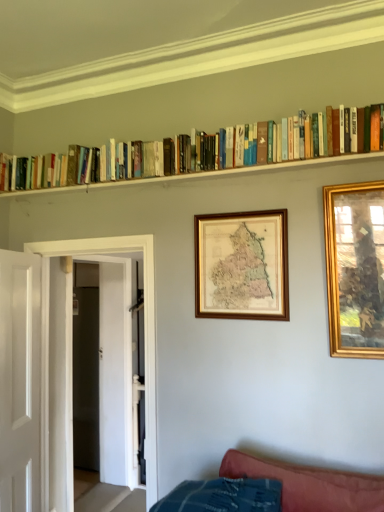
Question: Is gold-framed picture at right, arranged as the first picture frame when viewed from the front, oriented away from hardcover books at upper center?

Choices:
 (A) yes
 (B) no

Answer: (B)

Question: Is gold-framed picture at right, arranged as the 2th picture frame when viewed from the left, oriented towards hardcover books at upper center?

Choices:
 (A) yes
 (B) no

Answer: (B)

Question: Is there a large distance between gold-framed picture at right, arranged as the 2th picture frame when viewed from the left, and hardcover books at upper center?

Choices:
 (A) yes
 (B) no

Answer: (B)

Question: Is gold-framed picture at right, positioned as the second picture frame in back-to-front order, taller than hardcover books at upper center?

Choices:
 (A) no
 (B) yes

Answer: (B)

Question: Is gold-framed picture at right, positioned as the second picture frame in back-to-front order, closer to camera compared to hardcover books at upper center?

Choices:
 (A) no
 (B) yes

Answer: (A)

Question: Considering the relative sizes of gold-framed picture at right, arranged as the 2th picture frame when viewed from the left, and hardcover books at upper center in the image provided, is gold-framed picture at right, arranged as the 2th picture frame when viewed from the left, shorter than hardcover books at upper center?

Choices:
 (A) yes
 (B) no

Answer: (B)

Question: Does white smooth door at left, the 1th door positioned from the front, turn towards hardcover books at upper center?

Choices:
 (A) yes
 (B) no

Answer: (B)

Question: Are white smooth door at left, acting as the 2th door starting from the back, and hardcover books at upper center beside each other?

Choices:
 (A) yes
 (B) no

Answer: (B)

Question: Is white smooth door at left, the 1th door positioned from the front, outside of hardcover books at upper center?

Choices:
 (A) yes
 (B) no

Answer: (A)

Question: Is white smooth door at left, acting as the 2th door starting from the back, shorter than hardcover books at upper center?

Choices:
 (A) no
 (B) yes

Answer: (A)

Question: From the image's perspective, does white smooth door at left, the 1th door positioned from the front, appear lower than hardcover books at upper center?

Choices:
 (A) no
 (B) yes

Answer: (B)

Question: Does white smooth door at left, acting as the 2th door starting from the back, have a greater height compared to hardcover books at upper center?

Choices:
 (A) no
 (B) yes

Answer: (B)

Question: Is hardcover books at upper center at the right side of white smooth door at left, acting as the 2th door starting from the back?

Choices:
 (A) yes
 (B) no

Answer: (A)